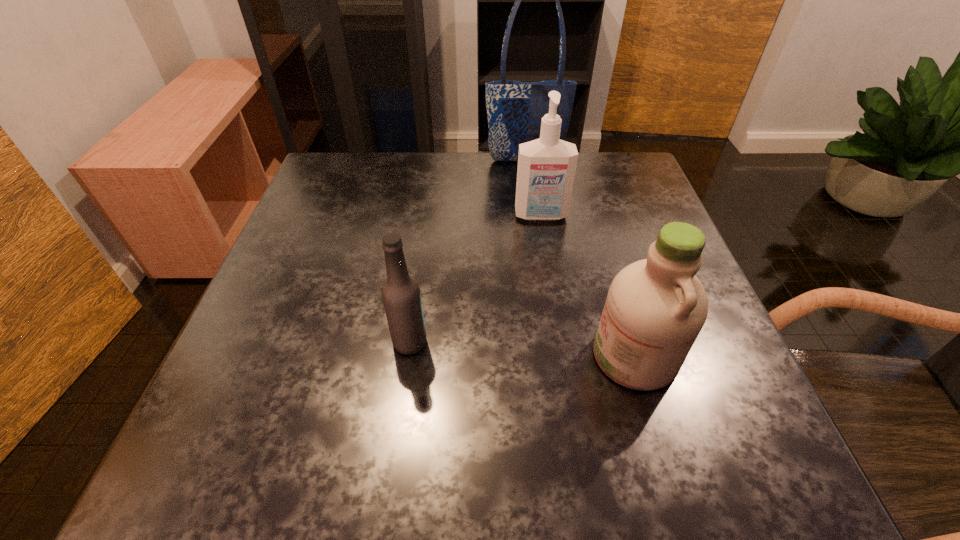
Where is `free space that satisfies the following two spatial constraints: 1. on the front-facing side of the tallest object; 2. on the label of the beer bottle`? Image resolution: width=960 pixels, height=540 pixels. free space that satisfies the following two spatial constraints: 1. on the front-facing side of the tallest object; 2. on the label of the beer bottle is located at coordinates (550, 342).

Locate an element on the screen. blank space that satisfies the following two spatial constraints: 1. on the front label of the third nearest object; 2. on the label of the beer bottle is located at coordinates (561, 342).